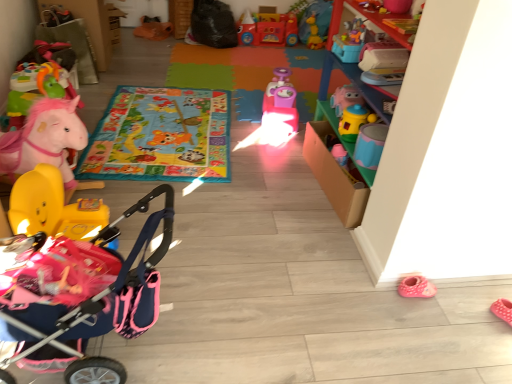
Question: From a real-world perspective, is vibrant fabric playmat at center, arranged as the 1th mat when viewed from the front, on pink plush horse at left, which appears as the 5th toy when viewed from the back?

Choices:
 (A) no
 (B) yes

Answer: (A)

Question: Is vibrant fabric playmat at center, arranged as the 1th mat when viewed from the front, outside pink plush horse at left, the 5th toy in the front-to-back sequence?

Choices:
 (A) no
 (B) yes

Answer: (B)

Question: From a real-world perspective, is vibrant fabric playmat at center, the second mat positioned from the back, under pink plush horse at left, the 5th toy in the front-to-back sequence?

Choices:
 (A) yes
 (B) no

Answer: (A)

Question: Is the depth of vibrant fabric playmat at center, arranged as the 1th mat when viewed from the front, greater than that of pink plush horse at left, the 5th toy in the front-to-back sequence?

Choices:
 (A) yes
 (B) no

Answer: (B)

Question: Could pink plush horse at left, the 5th toy in the front-to-back sequence, be considered to be inside vibrant fabric playmat at center, the second mat positioned from the back?

Choices:
 (A) no
 (B) yes

Answer: (A)

Question: Considering their positions, is pink plastic toy car at center, positioned as the fourth toy in back-to-front order, located in front of or behind matte pink stroller at left, which is the 1th toy in front-to-back order?

Choices:
 (A) behind
 (B) front

Answer: (A)

Question: From a real-world perspective, relative to matte pink stroller at left, the 9th toy when ordered from back to front, is pink plastic toy car at center, which ranks as the 6th toy in front-to-back order, vertically above or below?

Choices:
 (A) above
 (B) below

Answer: (B)

Question: In terms of height, does pink plastic toy car at center, which ranks as the 6th toy in front-to-back order, look taller or shorter compared to matte pink stroller at left, the 9th toy when ordered from back to front?

Choices:
 (A) tall
 (B) short

Answer: (B)

Question: Is point (284, 79) closer or farther from the camera than point (113, 246)?

Choices:
 (A) farther
 (B) closer

Answer: (A)

Question: Would you say pink plastic toy car at center, which ranks as the 6th toy in front-to-back order, is inside or outside vibrant fabric playmat at center, arranged as the 1th mat when viewed from the front?

Choices:
 (A) inside
 (B) outside

Answer: (B)

Question: Considering the positions of pink plastic toy car at center, positioned as the fourth toy in back-to-front order, and vibrant fabric playmat at center, the second mat positioned from the back, in the image, is pink plastic toy car at center, positioned as the fourth toy in back-to-front order, wider or thinner than vibrant fabric playmat at center, the second mat positioned from the back,?

Choices:
 (A) wide
 (B) thin

Answer: (B)

Question: Is point (263, 107) closer or farther from the camera than point (100, 119)?

Choices:
 (A) farther
 (B) closer

Answer: (A)

Question: From a real-world perspective, relative to vibrant fabric playmat at center, the second mat positioned from the back, is pink plastic toy car at center, which ranks as the 6th toy in front-to-back order, vertically above or below?

Choices:
 (A) above
 (B) below

Answer: (A)

Question: Based on their sizes in the image, would you say pink fabric baby carriage at lower left is bigger or smaller than orange fabric bag at upper center, the third toy when ordered from back to front?

Choices:
 (A) big
 (B) small

Answer: (A)

Question: Is pink fabric baby carriage at lower left taller or shorter than orange fabric bag at upper center, marked as the 7th toy in a front-to-back arrangement?

Choices:
 (A) short
 (B) tall

Answer: (B)